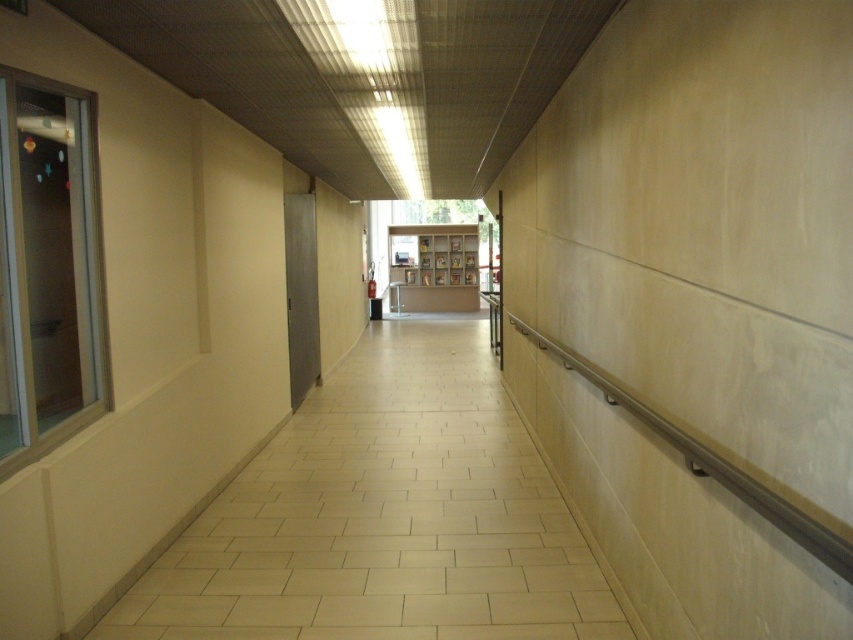
From the picture: Which is below, white tile floor at center or white matte bookshelf at center?

white tile floor at center is below.

Is white tile floor at center behind white matte bookshelf at center?

That is False.

I want to click on white tile floor at center, so click(384, 516).

Locate an element on the screen. This screenshot has height=640, width=853. white tile floor at center is located at coordinates tap(384, 516).